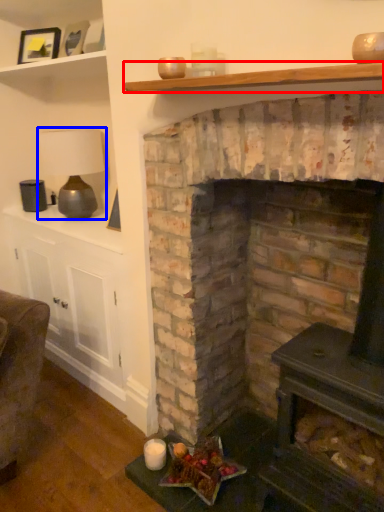
Question: Which point is further to the camera, shelf (highlighted by a red box) or lamp (highlighted by a blue box)?

Choices:
 (A) shelf
 (B) lamp

Answer: (B)